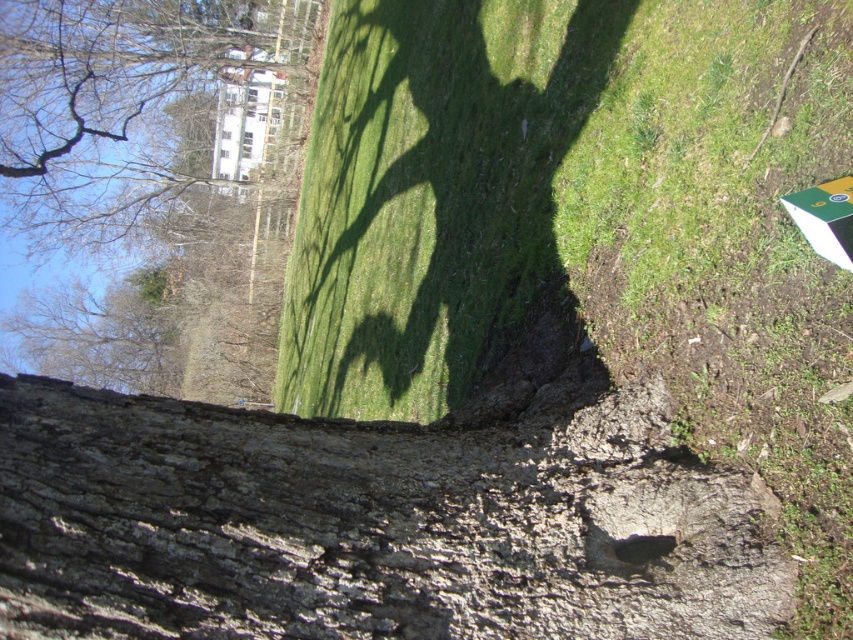
Question: Which point is closer to the camera?

Choices:
 (A) smooth bark tree at upper left
 (B) rough bark tree trunk at lower center

Answer: (B)

Question: Observing the image, what is the correct spatial positioning of rough bark tree trunk at lower center in reference to smooth bark tree at upper left?

Choices:
 (A) left
 (B) right

Answer: (B)

Question: Among these objects, which one is farthest from the camera?

Choices:
 (A) rough bark tree trunk at lower center
 (B) smooth bark tree at upper left

Answer: (B)

Question: Is rough bark tree trunk at lower center to the right of smooth bark tree at upper left from the viewer's perspective?

Choices:
 (A) no
 (B) yes

Answer: (B)

Question: Observing the image, what is the correct spatial positioning of rough bark tree trunk at lower center in reference to smooth bark tree at upper left?

Choices:
 (A) right
 (B) left

Answer: (A)